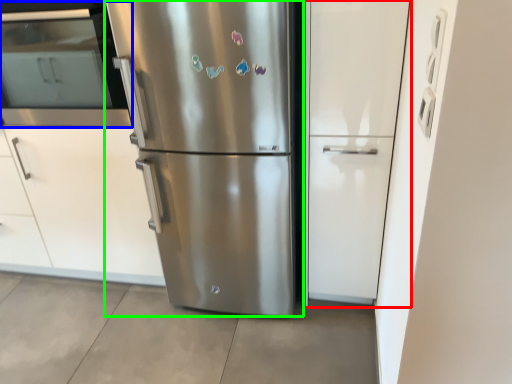
Question: Based on their relative distances, which object is nearer to glass door (highlighted by a red box)? Choose from oven (highlighted by a blue box) and refrigerator (highlighted by a green box).

Choices:
 (A) oven
 (B) refrigerator

Answer: (B)